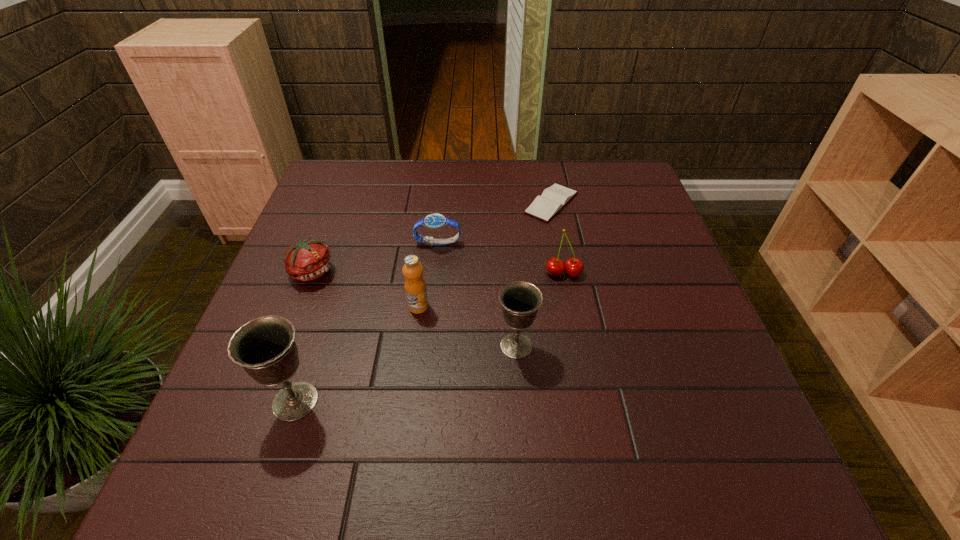
Find the location of `the taller chalice`. the taller chalice is located at coordinates (265, 347).

I want to click on the left chalice, so click(x=265, y=347).

At what (x,y) coordinates should I click in order to perform the action: click on the shorter chalice. Please return your answer as a coordinate pair (x, y). This screenshot has width=960, height=540. Looking at the image, I should click on (520, 300).

What are the coordinates of `the second nearest object` in the screenshot? It's located at (520, 300).

I want to click on the farthest object, so click(x=553, y=199).

You are a GUI agent. You are given a task and a screenshot of the screen. Output one action in this format:
    pyautogui.click(x=<x>, y=<y>)
    Task: Click on the diary
    The width and height of the screenshot is (960, 540).
    Given the screenshot: What is the action you would take?
    pyautogui.click(x=553, y=199)

Find the location of `tomato`. tomato is located at coordinates (309, 259).

You are a GUI agent. You are given a task and a screenshot of the screen. Output one action in this format:
    pyautogui.click(x=<x>, y=<y>)
    Task: Click on the sixth tallest object
    The height and width of the screenshot is (540, 960).
    Given the screenshot: What is the action you would take?
    pyautogui.click(x=433, y=221)

Find the location of `the second farthest object`. the second farthest object is located at coordinates (433, 221).

At what (x,y) coordinates should I click in order to perform the action: click on the fourth tallest object. Please return your answer as a coordinate pair (x, y). The image size is (960, 540). Looking at the image, I should click on (573, 266).